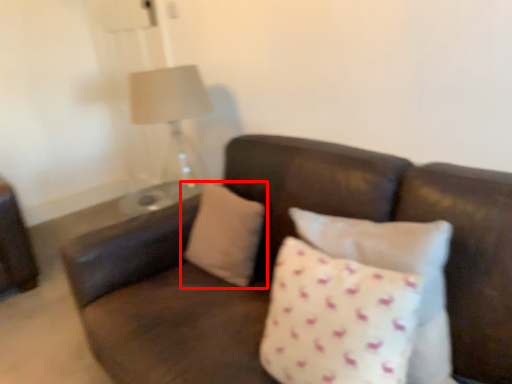
Question: From the image's perspective, where is pillow (annotated by the red box) located in relation to pillow in the image?

Choices:
 (A) above
 (B) below

Answer: (A)